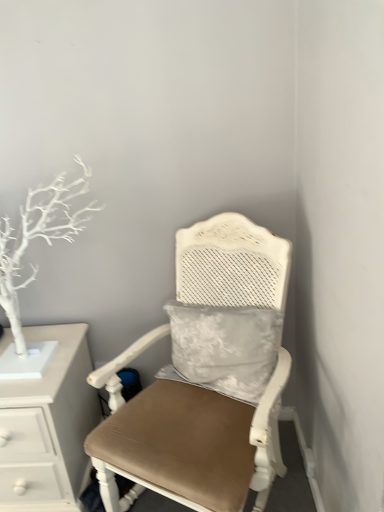
Question: Is matte white chair at center a part of white painted wood chest of drawers at left?

Choices:
 (A) yes
 (B) no

Answer: (B)

Question: Is white painted wood chest of drawers at left completely or partially outside of matte white chair at center?

Choices:
 (A) no
 (B) yes

Answer: (B)

Question: From the image's perspective, is white painted wood chest of drawers at left beneath matte white chair at center?

Choices:
 (A) yes
 (B) no

Answer: (A)

Question: Can you confirm if white painted wood chest of drawers at left is positioned to the left of matte white chair at center?

Choices:
 (A) yes
 (B) no

Answer: (A)

Question: From the image's perspective, is white painted wood chest of drawers at left on matte white chair at center?

Choices:
 (A) yes
 (B) no

Answer: (B)

Question: Considering the positions of white painted wood chest of drawers at left and matte white chair at center in the image, is white painted wood chest of drawers at left bigger or smaller than matte white chair at center?

Choices:
 (A) small
 (B) big

Answer: (A)

Question: Do you think white painted wood chest of drawers at left is within matte white chair at center, or outside of it?

Choices:
 (A) inside
 (B) outside

Answer: (B)

Question: Relative to matte white chair at center, is white painted wood chest of drawers at left in front or behind?

Choices:
 (A) front
 (B) behind

Answer: (B)

Question: Considering the positions of white painted wood chest of drawers at left and matte white chair at center in the image, is white painted wood chest of drawers at left wider or thinner than matte white chair at center?

Choices:
 (A) wide
 (B) thin

Answer: (B)

Question: Do you think white painted wood chest of drawers at left is within white matte tree at left, or outside of it?

Choices:
 (A) outside
 (B) inside

Answer: (A)

Question: Is white painted wood chest of drawers at left wider or thinner than white matte tree at left?

Choices:
 (A) thin
 (B) wide

Answer: (B)

Question: Based on their positions, is white painted wood chest of drawers at left located to the left or right of white matte tree at left?

Choices:
 (A) left
 (B) right

Answer: (A)

Question: Is white painted wood chest of drawers at left bigger or smaller than white matte tree at left?

Choices:
 (A) big
 (B) small

Answer: (A)

Question: Based on their sizes in the image, would you say white matte tree at left is bigger or smaller than matte white chair at center?

Choices:
 (A) big
 (B) small

Answer: (B)

Question: Do you think white matte tree at left is within matte white chair at center, or outside of it?

Choices:
 (A) inside
 (B) outside

Answer: (B)